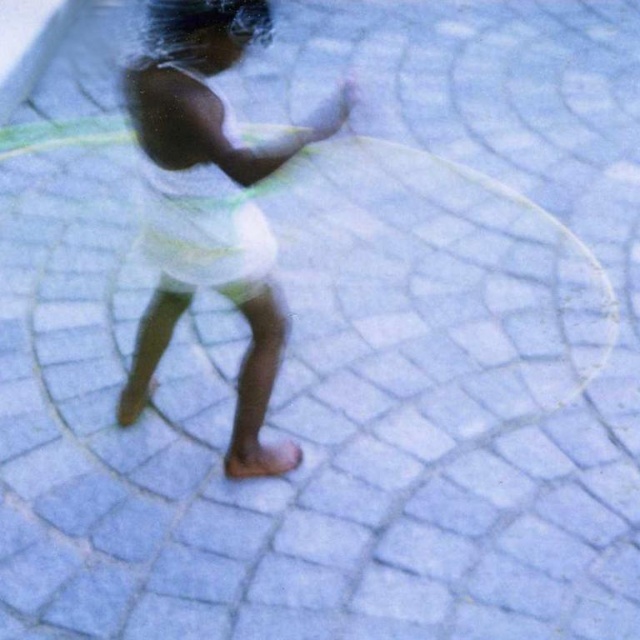
You are a fashion designer observing a blurred image of a person wearing two dresses. The scene has a circular tiled background. Which dress, the smooth white dress at center or the white cotton dress at center, is positioned lower on the person?

The smooth white dress at center is positioned lower because it is described as being below the white cotton dress at center.

You are a photographer trying to focus on two points in the image. The first point is at coordinates point (218, 116) and the second is at point (179, 131). Which point is closer to the camera?

Point (218, 116) is further to the camera than point (179, 131), so the second point is closer to the camera.